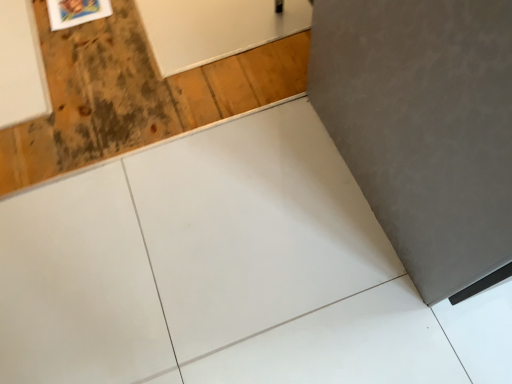
Where is `vacant area on top of wooden plywood at upper left (from a real-world perspective)`? Image resolution: width=512 pixels, height=384 pixels. vacant area on top of wooden plywood at upper left (from a real-world perspective) is located at coordinates (138, 63).